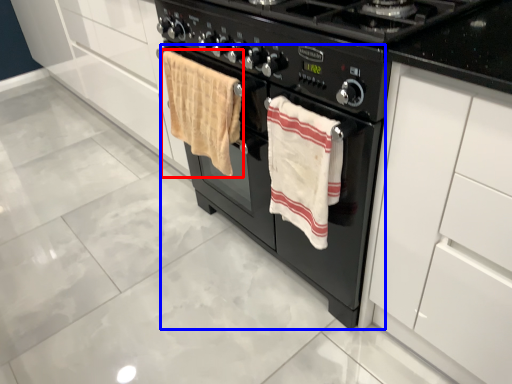
Question: Which of the following is the closest to the observer, beach towel (highlighted by a red box) or oven (highlighted by a blue box)?

Choices:
 (A) beach towel
 (B) oven

Answer: (B)